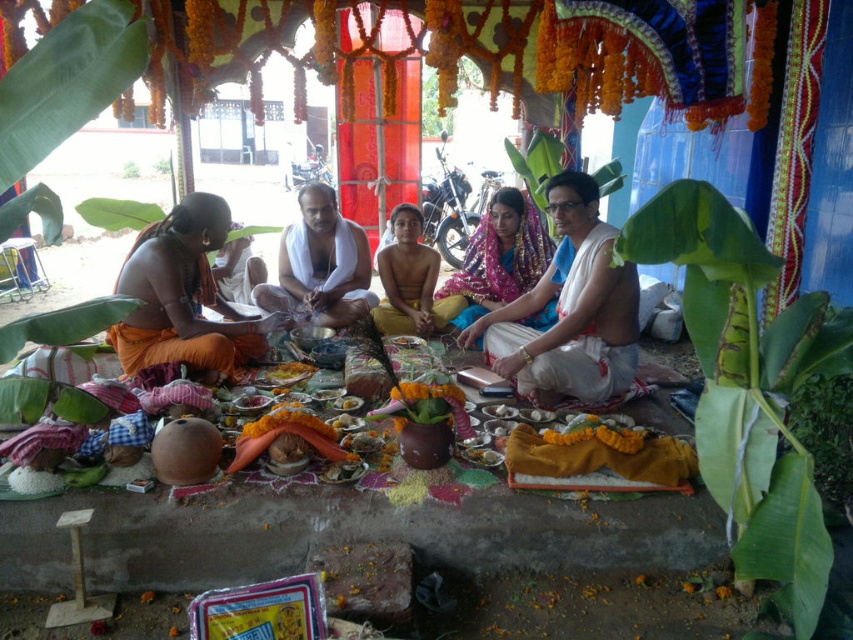
From the picture: Does silk saree at center appear under white clothed man at center?

Yes.

Does point (569, 259) come behind point (294, 253)?

No, (569, 259) is closer to viewer.

At what (x,y) coordinates should I click in order to perform the action: click on silk saree at center. Please return your answer as a coordinate pair (x, y). This screenshot has width=853, height=640. Looking at the image, I should click on (569, 310).

Between silk saree at center and brown skin child at center, which one appears on the right side from the viewer's perspective?

silk saree at center

How far apart are silk saree at center and brown skin child at center?

silk saree at center and brown skin child at center are 3.69 feet apart.

Describe the element at coordinates (569, 310) in the screenshot. This screenshot has width=853, height=640. I see `silk saree at center` at that location.

Identify the location of silk saree at center. (569, 310).

Who is more forward, (341, 314) or (412, 312)?

Positioned in front is point (341, 314).

Which is more to the left, white clothed man at center or brown skin child at center?

white clothed man at center

Where is `white clothed man at center`? The height and width of the screenshot is (640, 853). white clothed man at center is located at coordinates (320, 264).